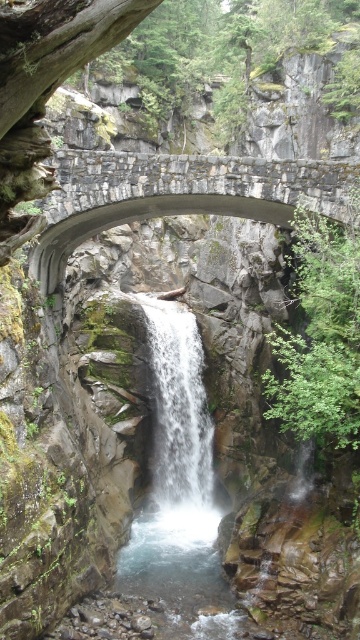
You are a hiker planning to cross the canyon using the rustic stone bridge at center. There is also white frothy water at center below the bridge. Can you estimate if the bridge is wide enough to allow you to walk across safely without stepping onto the white frothy water?

The rustic stone bridge at center is wider than the white frothy water at center, so it is safe to walk across the rustic stone bridge at center without stepping onto the white frothy water.

You are standing at the base of the canyon looking up at the stone bridge and waterfall. There are two points marked on the bridge structure. Which point, point (308, 202) or point (164, 444), is closer to your current position?

Point (308, 202) is closer to the camera than point (164, 444), so it is closer to your current position.

You are a hiker planning to cross the rustic stone bridge at center. There is a white frothy water at center below it. If you drop a rock from the bridge, how far will it fall before hitting the water?

The rustic stone bridge at center and white frothy water at center are 23.70 meters apart, so the rock will fall 23.70 meters before hitting the water.